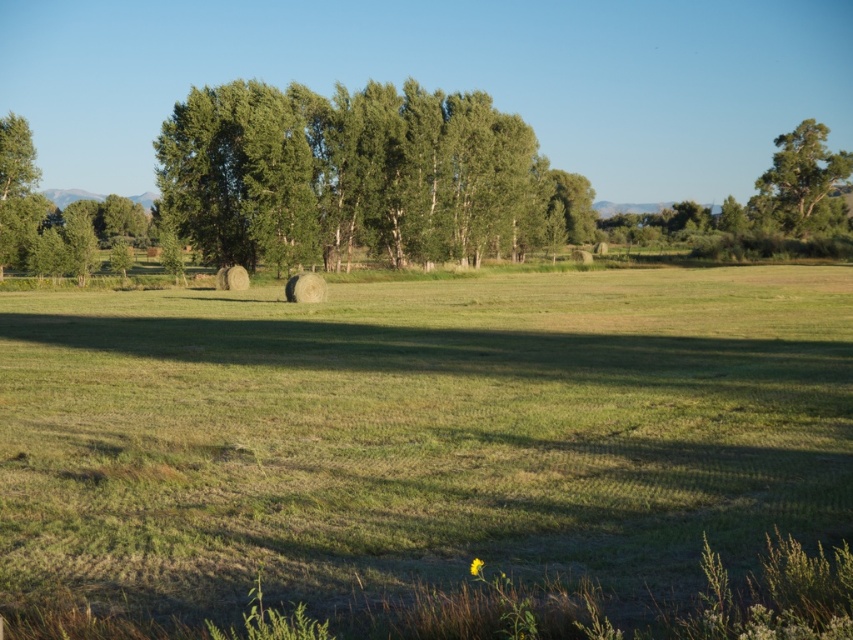
Is green grassy field at center wider than green leafy tree at left?

Yes, green grassy field at center is wider than green leafy tree at left.

What do you see at coordinates (416, 435) in the screenshot? This screenshot has width=853, height=640. I see `green grassy field at center` at bounding box center [416, 435].

Who is more distant from viewer, (618, 525) or (18, 257)?

Point (18, 257)

Where is `green grassy field at center`? This screenshot has height=640, width=853. green grassy field at center is located at coordinates (416, 435).

Measure the distance between green leafy trees at upper left and green leafy tree at upper right.

green leafy trees at upper left and green leafy tree at upper right are 152.77 feet apart from each other.

Is green leafy trees at upper left thinner than green leafy tree at upper right?

No.

You are a GUI agent. You are given a task and a screenshot of the screen. Output one action in this format:
    pyautogui.click(x=<x>, y=<y>)
    Task: Click on the green leafy trees at upper left
    
    Given the screenshot: What is the action you would take?
    pyautogui.click(x=360, y=177)

Which of these two, green grassy field at center or green leafy trees at upper left, stands taller?

Standing taller between the two is green leafy trees at upper left.

Between green grassy field at center and green leafy trees at upper left, which one appears on the left side from the viewer's perspective?

Positioned to the left is green grassy field at center.

Identify the location of green grassy field at center. (416, 435).

The width and height of the screenshot is (853, 640). In order to click on green grassy field at center in this screenshot , I will do `click(416, 435)`.